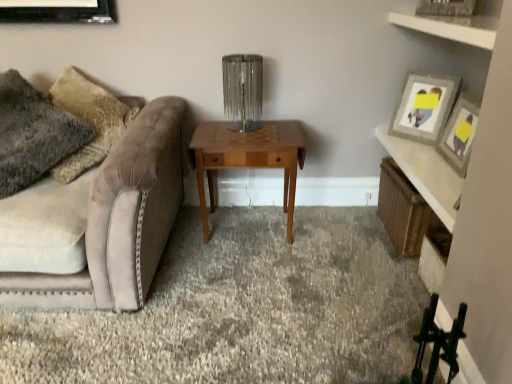
I want to click on unoccupied region to the right of wooden table at center, so 333,243.